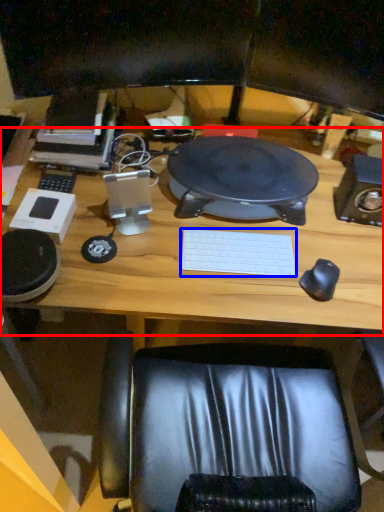
Question: Which object is closer to the camera taking this photo, computer desk (highlighted by a red box) or laptop keyboard (highlighted by a blue box)?

Choices:
 (A) computer desk
 (B) laptop keyboard

Answer: (A)